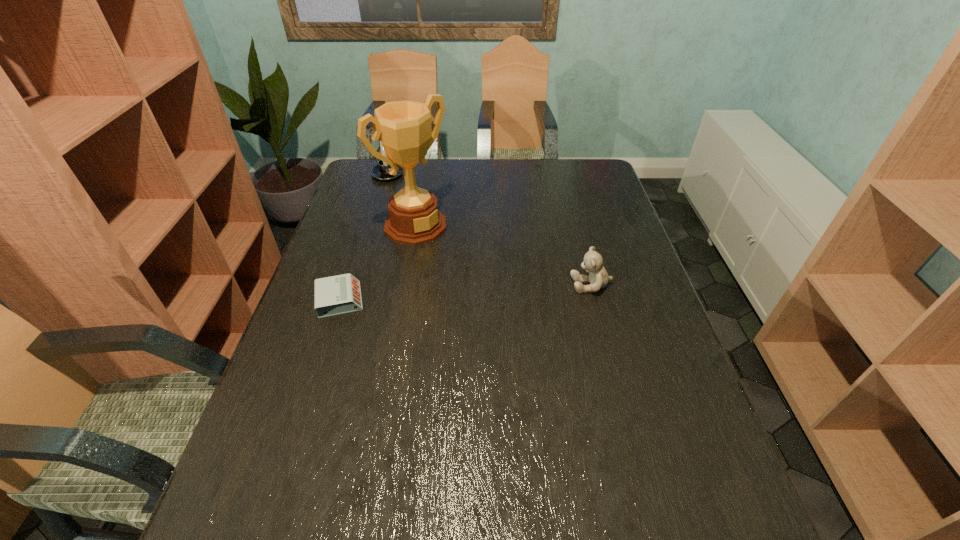
You are a GUI agent. You are given a task and a screenshot of the screen. Output one action in this format:
    pyautogui.click(x=<x>, y=<y>)
    Task: Click on the empty space that is in between the rightmost object and the tallest object
    The width and height of the screenshot is (960, 540).
    Given the screenshot: What is the action you would take?
    pyautogui.click(x=503, y=255)

Where is `empty location between the tallest object and the third tallest object`? The width and height of the screenshot is (960, 540). empty location between the tallest object and the third tallest object is located at coordinates (503, 255).

The width and height of the screenshot is (960, 540). I want to click on vacant space in between the teddy bear and the third shortest object, so click(x=490, y=230).

The image size is (960, 540). I want to click on empty space that is in between the alarm clock and the second farthest object, so click(x=378, y=263).

The width and height of the screenshot is (960, 540). What are the coordinates of `free point between the shortest object and the third nearest object` in the screenshot? It's located at (378, 263).

The image size is (960, 540). I want to click on blank region between the alarm clock and the farthest object, so click(364, 237).

Locate an element on the screen. object that stands as the closest to the candle holder is located at coordinates (404, 127).

Locate an element on the screen. object that is the second closest to the farthest object is located at coordinates (340, 294).

You are a GUI agent. You are given a task and a screenshot of the screen. Output one action in this format:
    pyautogui.click(x=<x>, y=<y>)
    Task: Click on the vacant space that satisfies the following two spatial constraints: 1. on the back side of the alarm clock; 2. on the face of the teddy bear
    Image resolution: width=960 pixels, height=540 pixels.
    Given the screenshot: What is the action you would take?
    pyautogui.click(x=345, y=285)

Locate an element on the screen. vacant space that satisfies the following two spatial constraints: 1. on the back side of the award; 2. on the right side of the alarm clock is located at coordinates (364, 226).